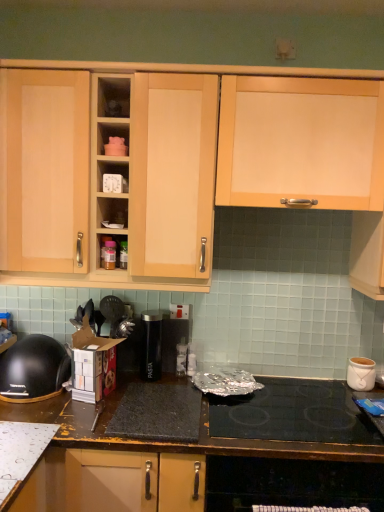
Question: Can you confirm if black glass cooktop at lower center is smaller than black plastic bowl at lower left?

Choices:
 (A) yes
 (B) no

Answer: (B)

Question: Would you say black glass cooktop at lower center is outside black plastic bowl at lower left?

Choices:
 (A) no
 (B) yes

Answer: (B)

Question: From the image's perspective, is black glass cooktop at lower center located beneath black plastic bowl at lower left?

Choices:
 (A) yes
 (B) no

Answer: (A)

Question: Is black glass cooktop at lower center with black plastic bowl at lower left?

Choices:
 (A) no
 (B) yes

Answer: (A)

Question: Are black glass cooktop at lower center and black plastic bowl at lower left far apart?

Choices:
 (A) yes
 (B) no

Answer: (B)

Question: Is black plastic bowl at lower left wider or thinner than light wood cabinet at upper left, the 1th cabinetry viewed from the left?

Choices:
 (A) wide
 (B) thin

Answer: (B)

Question: Do you think black plastic bowl at lower left is within light wood cabinet at upper left, the 2th cabinetry in the right-to-left sequence, or outside of it?

Choices:
 (A) outside
 (B) inside

Answer: (A)

Question: Based on their positions, is black plastic bowl at lower left located to the left or right of light wood cabinet at upper left, the 1th cabinetry viewed from the left?

Choices:
 (A) right
 (B) left

Answer: (B)

Question: From the image's perspective, is black plastic bowl at lower left positioned above or below light wood cabinet at upper left, the 1th cabinetry viewed from the left?

Choices:
 (A) below
 (B) above

Answer: (A)

Question: From a real-world perspective, is matte plastic shelf at center, the first shelf viewed from the top, positioned above or below white plastic container at upper center, the 1th shelf from the bottom?

Choices:
 (A) above
 (B) below

Answer: (A)

Question: Choose the correct answer: Is matte plastic shelf at center, which is counted as the 2th shelf, starting from the bottom, inside white plastic container at upper center, the 1th shelf from the bottom, or outside it?

Choices:
 (A) inside
 (B) outside

Answer: (B)

Question: Considering the relative positions of matte plastic shelf at center, which is counted as the 2th shelf, starting from the bottom, and white plastic container at upper center, which is counted as the second shelf, starting from the top, in the image provided, is matte plastic shelf at center, which is counted as the 2th shelf, starting from the bottom, to the left or to the right of white plastic container at upper center, which is counted as the second shelf, starting from the top,?

Choices:
 (A) left
 (B) right

Answer: (B)

Question: Is matte plastic shelf at center, the first shelf viewed from the top, in front of or behind white plastic container at upper center, which is counted as the second shelf, starting from the top, in the image?

Choices:
 (A) front
 (B) behind

Answer: (A)

Question: Based on their positions, is dark brown laminate countertop at lower center located to the left or right of black glass cooktop at lower center?

Choices:
 (A) right
 (B) left

Answer: (B)

Question: Is dark brown laminate countertop at lower center wider or thinner than black glass cooktop at lower center?

Choices:
 (A) wide
 (B) thin

Answer: (A)